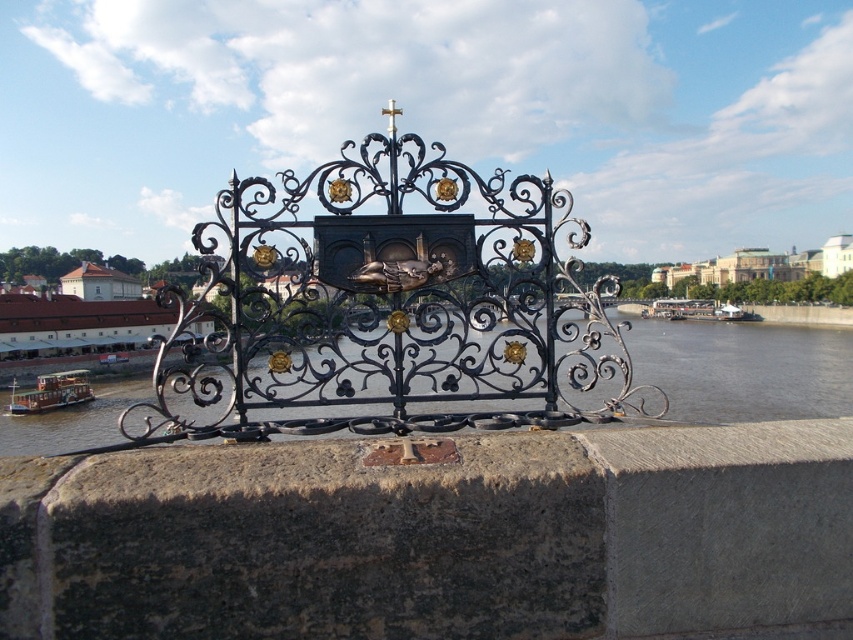
You are standing on the rusty stone ledge at center and want to look down at the brown wooden boat at left. Is the boat directly below you or to the side?

The rusty stone ledge at center is positioned over the brown wooden boat at left, so the boat is directly below you.

You are standing in front of the decorative wrought iron railing and notice the rusty stone ledge at center. Based on its coordinates, is the ledge positioned closer to the top or bottom of the image?

The rusty stone ledge at center is located at point (x=434, y=538), which means it is positioned closer to the bottom of the image since the y coordinate is 0.511, indicating it is just above the midpoint.